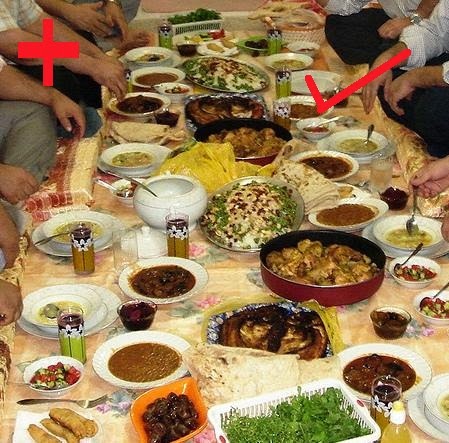
You are a GUI agent. You are given a task and a screenshot of the screen. Output one action in this format:
    pyautogui.click(x=<x>, y=<y>)
    Task: Click on the spoon
    The height and width of the screenshot is (443, 449).
    Given the screenshot: What is the action you would take?
    pyautogui.click(x=337, y=89), pyautogui.click(x=440, y=293), pyautogui.click(x=404, y=264), pyautogui.click(x=412, y=220), pyautogui.click(x=369, y=136), pyautogui.click(x=322, y=124), pyautogui.click(x=47, y=238), pyautogui.click(x=55, y=313)